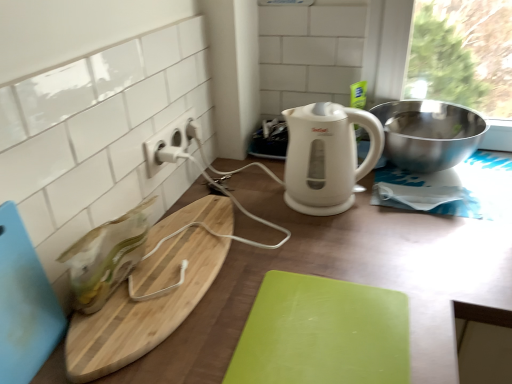
Question: Does white plastic electric outlet at upper center have a lesser height compared to natural wood cutting board at left, which is the 2th cutting board from left to right?

Choices:
 (A) no
 (B) yes

Answer: (A)

Question: Does white plastic electric outlet at upper center touch natural wood cutting board at left, the second cutting board when ordered from right to left?

Choices:
 (A) yes
 (B) no

Answer: (B)

Question: Does white plastic electric outlet at upper center have a greater height compared to natural wood cutting board at left, the second cutting board when ordered from right to left?

Choices:
 (A) yes
 (B) no

Answer: (A)

Question: Is white plastic electric outlet at upper center not near natural wood cutting board at left, the second cutting board when ordered from right to left?

Choices:
 (A) no
 (B) yes

Answer: (A)

Question: Is natural wood cutting board at left, which is the 2th cutting board from left to right, a part of white plastic electric outlet at upper center?

Choices:
 (A) yes
 (B) no

Answer: (B)

Question: Considering the relative sizes of white plastic electric outlet at upper center and natural wood cutting board at left, the second cutting board when ordered from right to left, in the image provided, is white plastic electric outlet at upper center wider than natural wood cutting board at left, the second cutting board when ordered from right to left,?

Choices:
 (A) yes
 (B) no

Answer: (B)

Question: Is wooden cutting board at center smaller than white glossy electric kettle at center?

Choices:
 (A) yes
 (B) no

Answer: (B)

Question: Is wooden cutting board at center looking in the opposite direction of white glossy electric kettle at center?

Choices:
 (A) no
 (B) yes

Answer: (A)

Question: From the image's perspective, is wooden cutting board at center on white glossy electric kettle at center?

Choices:
 (A) yes
 (B) no

Answer: (B)

Question: Is there a large distance between wooden cutting board at center and white glossy electric kettle at center?

Choices:
 (A) no
 (B) yes

Answer: (A)

Question: Is wooden cutting board at center facing towards white glossy electric kettle at center?

Choices:
 (A) no
 (B) yes

Answer: (A)

Question: Is wooden cutting board at center not inside white glossy electric kettle at center?

Choices:
 (A) yes
 (B) no

Answer: (A)

Question: Considering the relative sizes of white plastic electric outlet at upper center and green matte cutting board at center, marked as the first cutting board in a right-to-left arrangement, in the image provided, is white plastic electric outlet at upper center smaller than green matte cutting board at center, marked as the first cutting board in a right-to-left arrangement,?

Choices:
 (A) yes
 (B) no

Answer: (A)